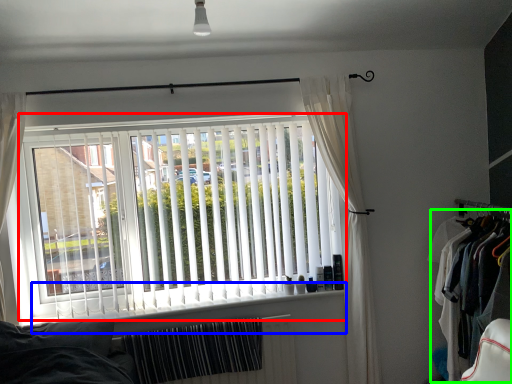
Question: Which is farther away from window blind (highlighted by a red box)? window sill (highlighted by a blue box) or clothing (highlighted by a green box)?

Choices:
 (A) window sill
 (B) clothing

Answer: (B)